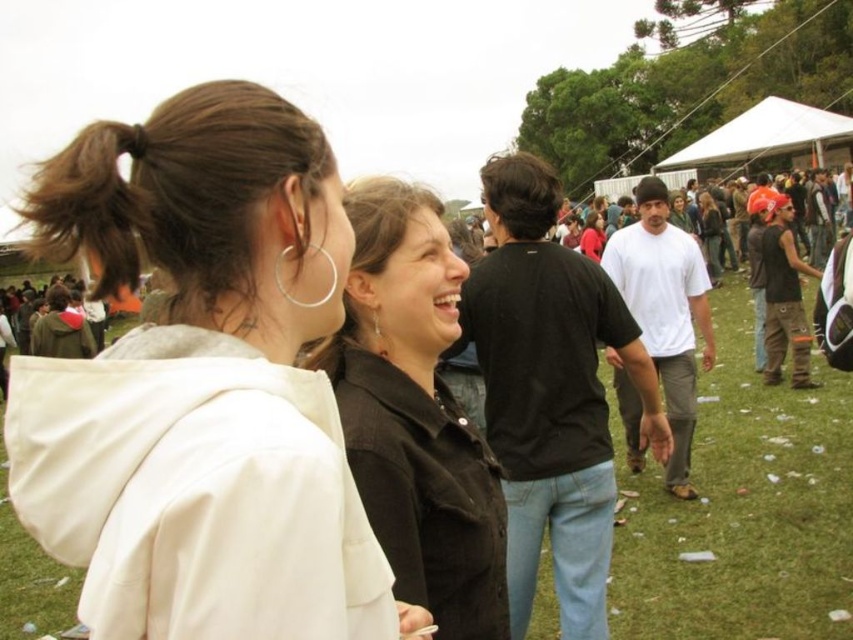
Does white matte jacket at upper left appear on the left side of black matte shirt at center?

Yes, white matte jacket at upper left is to the left of black matte shirt at center.

Which is below, white matte jacket at upper left or black matte shirt at center?

black matte shirt at center is lower down.

The image size is (853, 640). What are the coordinates of `white matte jacket at upper left` in the screenshot? It's located at (202, 385).